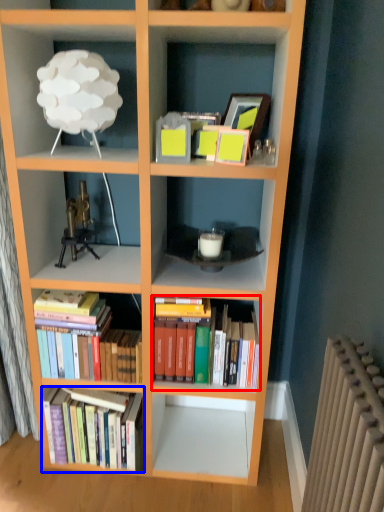
Question: Which object appears closest to the camera in this image, book (highlighted by a red box) or book (highlighted by a blue box)?

Choices:
 (A) book
 (B) book

Answer: (A)